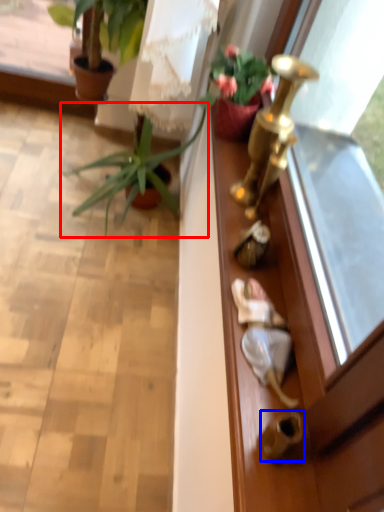
Question: Which object appears closest to the camera in this image, houseplant (highlighted by a red box) or door handle (highlighted by a blue box)?

Choices:
 (A) houseplant
 (B) door handle

Answer: (B)